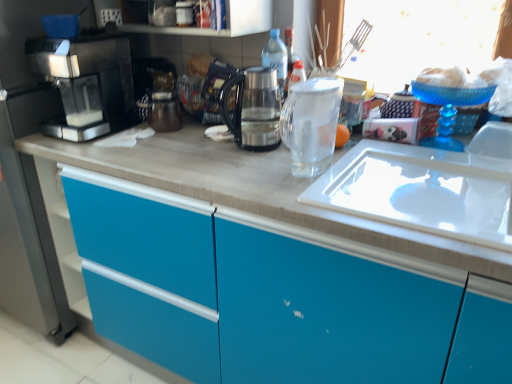
Identify the location of vacant area that lies in front of transparent glass at center. The height and width of the screenshot is (384, 512). (367, 170).